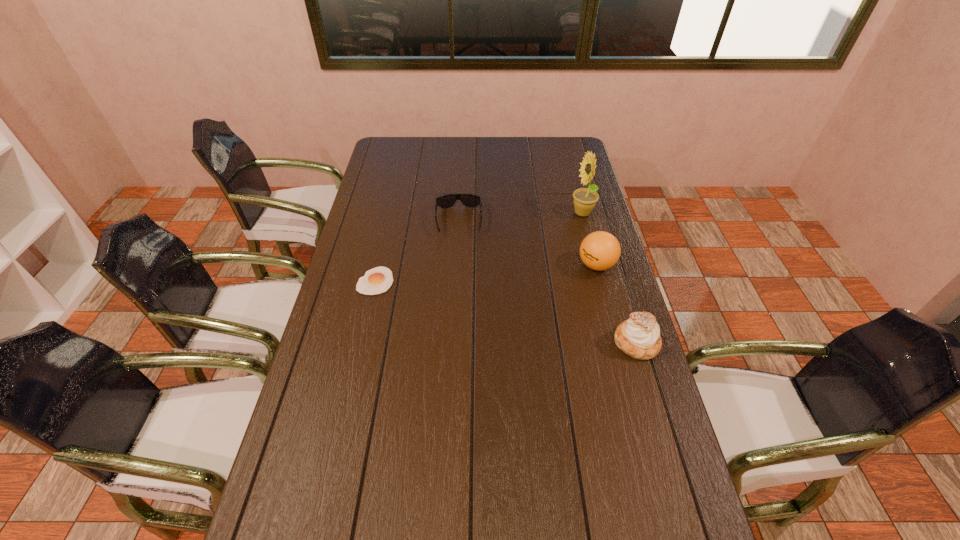
Image resolution: width=960 pixels, height=540 pixels. What are the coordinates of `free spot between the egg yolk and the sunglasses` in the screenshot? It's located at (418, 251).

Where is `vacant space in between the ping-pong ball and the nearest object`? vacant space in between the ping-pong ball and the nearest object is located at coordinates (616, 304).

Where is `unoccupied position between the ping-pong ball and the egg yolk`? This screenshot has width=960, height=540. unoccupied position between the ping-pong ball and the egg yolk is located at coordinates (486, 273).

At what (x,y) coordinates should I click in order to perform the action: click on free space between the pastry and the second shortest object. Please return your answer as a coordinate pair (x, y). Looking at the image, I should click on click(x=547, y=282).

Where is `free space between the pastry and the sunglasses`? The image size is (960, 540). free space between the pastry and the sunglasses is located at coordinates (547, 282).

At what (x,y) coordinates should I click in order to perform the action: click on the fourth closest object to the shortest object. Please return your answer as a coordinate pair (x, y). This screenshot has width=960, height=540. Looking at the image, I should click on [x=639, y=337].

At what (x,y) coordinates should I click in order to perform the action: click on object that can be found as the third closest to the tallest object. Please return your answer as a coordinate pair (x, y). Looking at the image, I should click on (639, 337).

Identify the location of vacant point that satisfies the following two spatial constraints: 1. on the back side of the sunglasses; 2. on the right side of the shortest object. This screenshot has height=540, width=960. (389, 221).